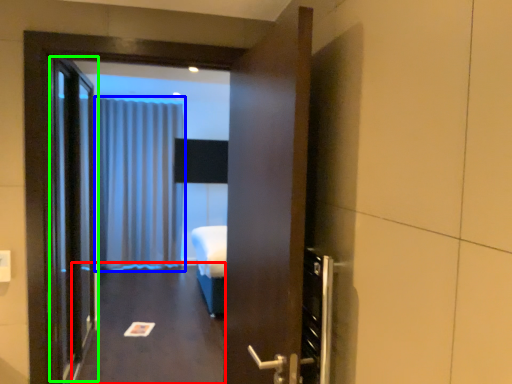
Question: Which is farther away from corridor (highlighted by a red box)? curtain (highlighted by a blue box) or elevator door (highlighted by a green box)?

Choices:
 (A) curtain
 (B) elevator door

Answer: (A)